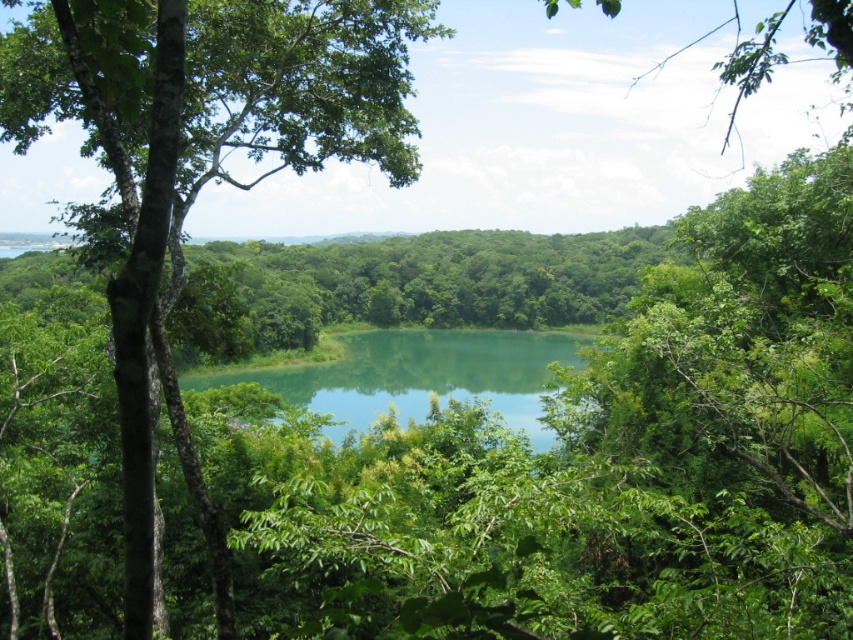
Is green leafy tree at center taller than green liquid at center?

Indeed, green leafy tree at center has a greater height compared to green liquid at center.

How far apart are green leafy tree at center and green liquid at center?

green leafy tree at center is 32.49 meters away from green liquid at center.

Is point (312, 17) behind point (317, 364)?

That is False.

This screenshot has width=853, height=640. Find the location of `green leafy tree at center`. green leafy tree at center is located at coordinates (199, 164).